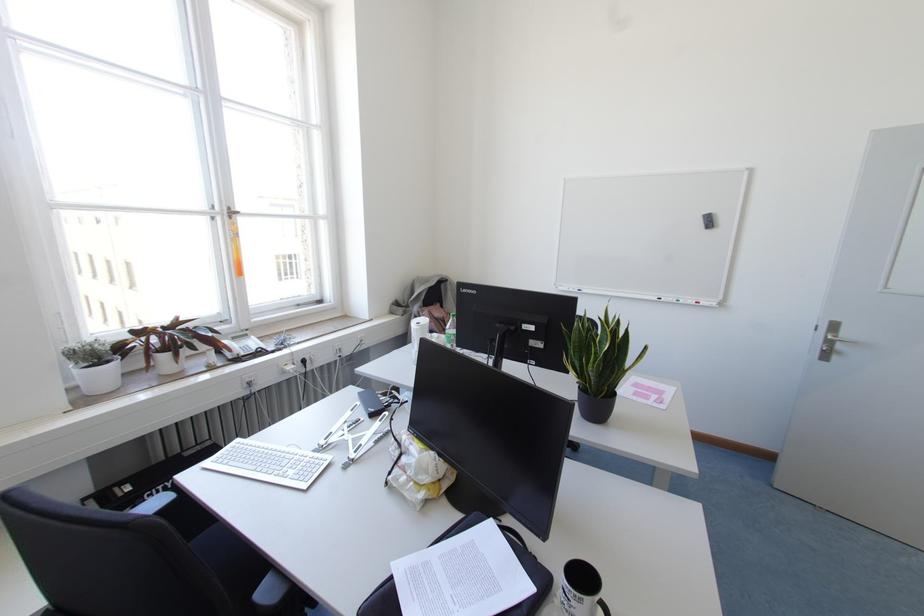
Where is `metal door handle`? This screenshot has height=616, width=924. metal door handle is located at coordinates (840, 339).